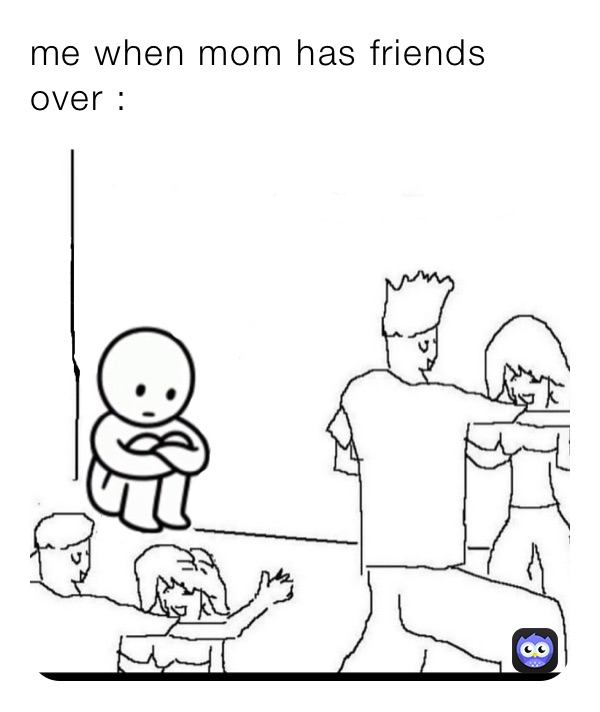
Identify the location of white wall. (300, 342).